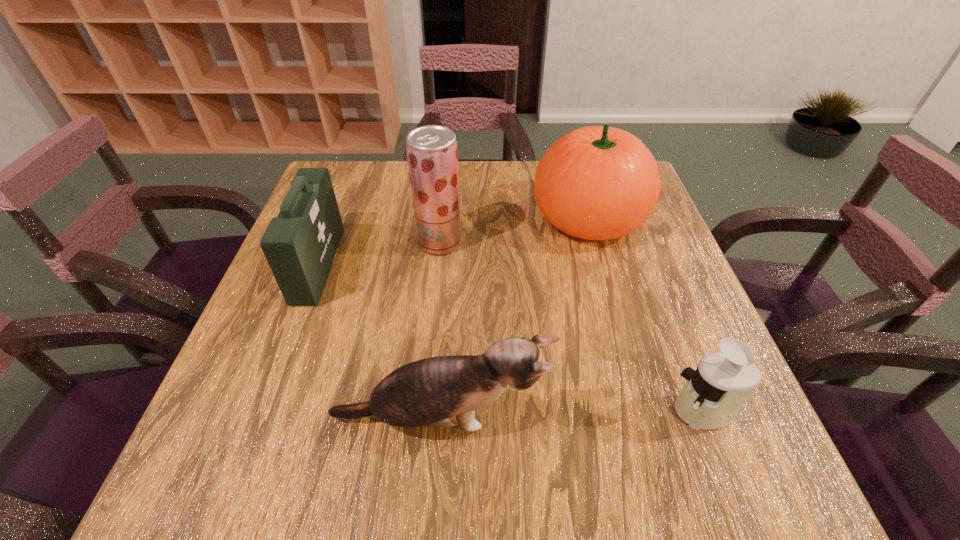
You are a GUI agent. You are given a task and a screenshot of the screen. Output one action in this format:
    pyautogui.click(x=<x>, y=<y>)
    Task: Click on the fruit juice
    The height and width of the screenshot is (540, 960).
    Given the screenshot: What is the action you would take?
    pyautogui.click(x=432, y=153)

Locate an element on the screen. pumpkin is located at coordinates pos(599,183).

Image resolution: width=960 pixels, height=540 pixels. In order to click on cat in this screenshot , I will do `click(438, 391)`.

Find the location of `the leftmost object`. the leftmost object is located at coordinates (300, 244).

Locate an element on the screen. Image resolution: width=960 pixels, height=540 pixels. juicer is located at coordinates (713, 395).

Where is `free location located 0.200m on the right of the fruit juice`? This screenshot has height=540, width=960. free location located 0.200m on the right of the fruit juice is located at coordinates (544, 242).

Where is `vacant space located 0.240m on the left of the pumpkin`? vacant space located 0.240m on the left of the pumpkin is located at coordinates (438, 217).

Locate an element on the screen. Image resolution: width=960 pixels, height=540 pixels. vacant area located 0.340m at the face of the cat is located at coordinates (750, 418).

You are a GUI agent. You are given a task and a screenshot of the screen. Output one action in this format:
    pyautogui.click(x=<x>, y=<y>)
    Task: Click on the vacant space located 0.230m on the front-facing side of the first-aid kit
    
    Given the screenshot: What is the action you would take?
    [433, 265]

At what (x,y) coordinates should I click in order to perform the action: click on free region located on the left of the juicer. Please return your answer as a coordinate pair (x, y). This screenshot has width=960, height=540. Looking at the image, I should click on (459, 411).